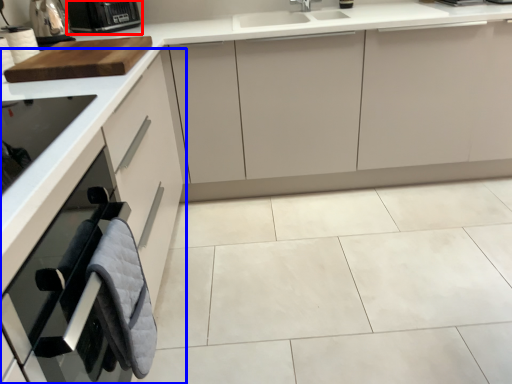
Question: Which of the following is the closest to the observer, kitchen appliance (highlighted by a red box) or cabinetry (highlighted by a blue box)?

Choices:
 (A) kitchen appliance
 (B) cabinetry

Answer: (B)